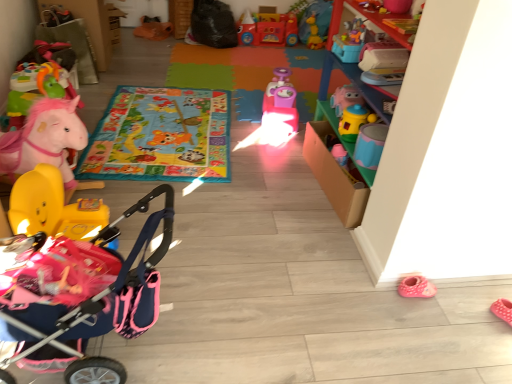
Question: Relative to orange fabric bag at upper center, the third toy when ordered from back to front, is pink fabric baby carriage at lower left in front or behind?

Choices:
 (A) front
 (B) behind

Answer: (A)

Question: From a real-world perspective, is pink fabric baby carriage at lower left positioned above or below orange fabric bag at upper center, the third toy when ordered from back to front?

Choices:
 (A) above
 (B) below

Answer: (A)

Question: Based on their relative distances, which object is nearer to the multicolored foam mat at center, which is counted as the 1th mat, starting from the back?

Choices:
 (A) matte pink plush horse at left, which is counted as the 8th toy, starting from the back
 (B) matte yellow toy at center, the 3th toy in the front-to-back sequence
 (C) matte pink stroller at left, which is the 1th toy in front-to-back order
 (D) pink plastic toy car at center, which ranks as the 6th toy in front-to-back order
 (E) vibrant fabric playmat at center, the second mat positioned from the back

Answer: (E)

Question: Estimate the real-world distances between objects in this image. Which object is closer to the pink plush horse at left, which appears as the 5th toy when viewed from the back?

Choices:
 (A) matte pink plush horse at left, placed as the 2th toy when sorted from front to back
 (B) rubberized plastic toy car at upper center, arranged as the 8th toy when viewed from the front
 (C) vibrant fabric playmat at center, arranged as the 1th mat when viewed from the front
 (D) matte pink stroller at left, the 9th toy when ordered from back to front
 (E) pink fabric baby carriage at lower left

Answer: (A)